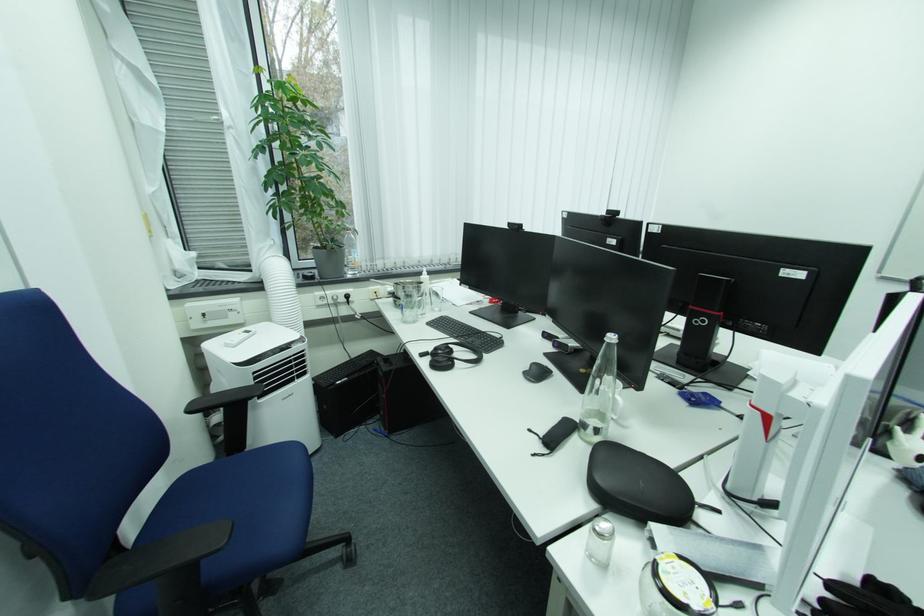
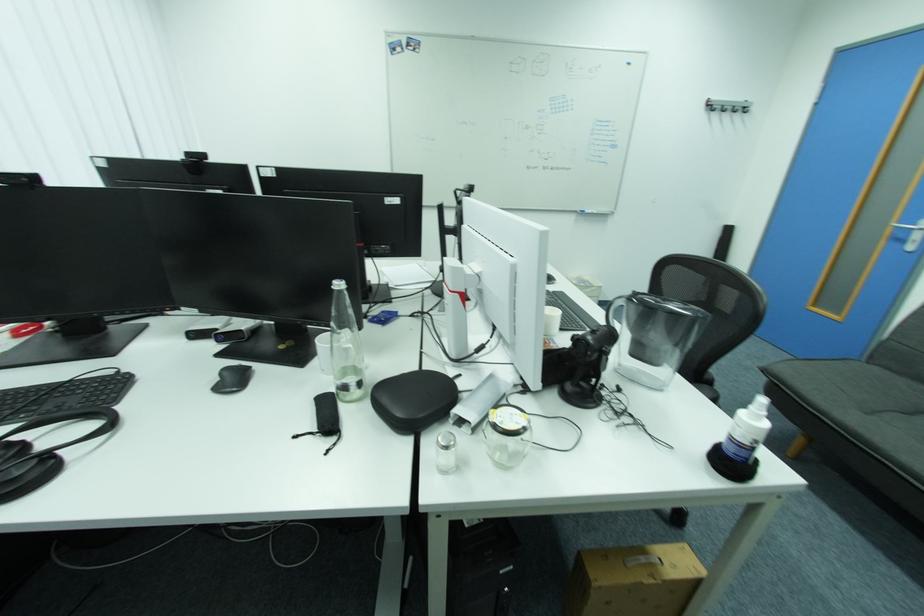
Locate, in the second image, the point that corresponds to the point at 541,368 in the first image.

(232, 375)